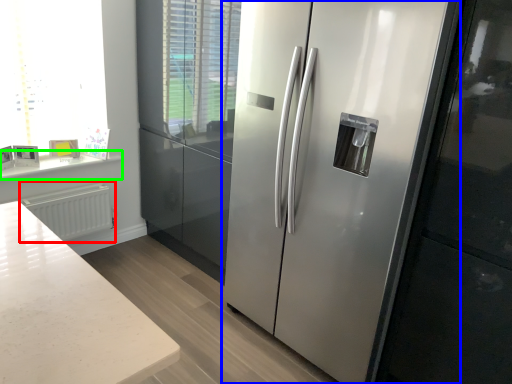
Question: Considering the real-world distances, which object is closest to radiator (highlighted by a red box)? refrigerator (highlighted by a blue box) or counter top (highlighted by a green box).

Choices:
 (A) refrigerator
 (B) counter top

Answer: (B)